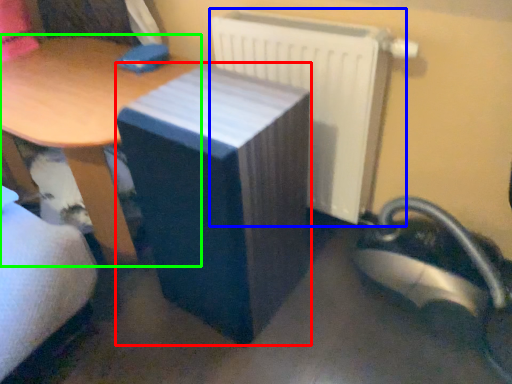
Question: Which is nearer to the table (highlighted by a red box)? radiator (highlighted by a blue box) or table (highlighted by a green box).

Choices:
 (A) radiator
 (B) table

Answer: (A)